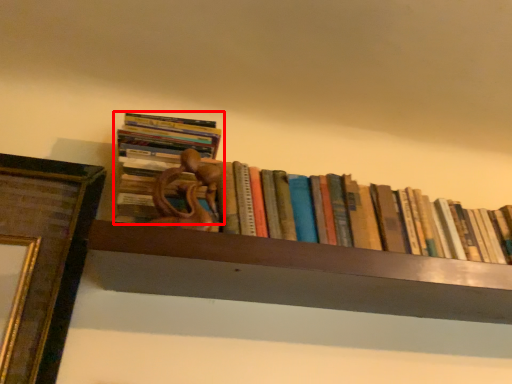
Question: From the image's perspective, what is the correct spatial positioning of book (annotated by the red box) in reference to book?

Choices:
 (A) above
 (B) below

Answer: (A)